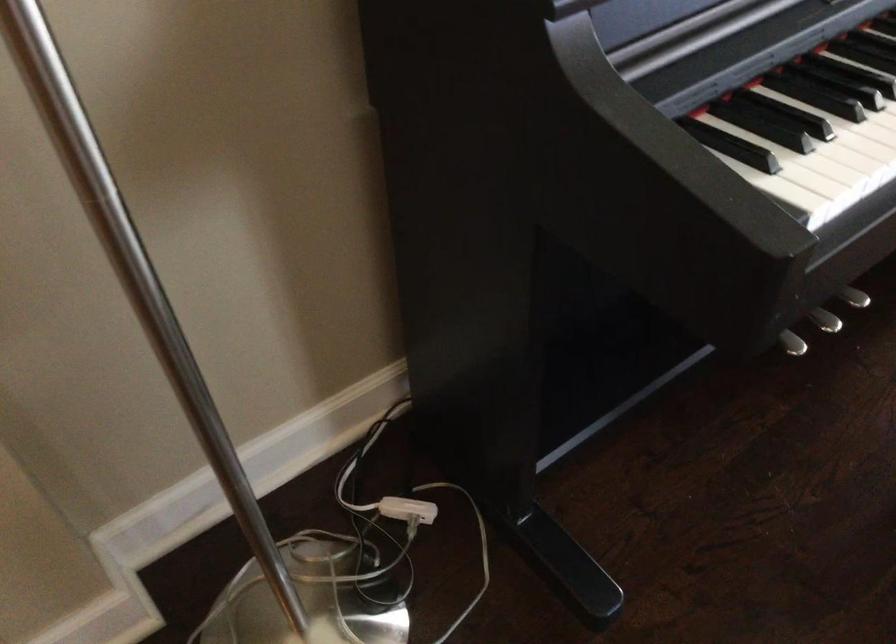
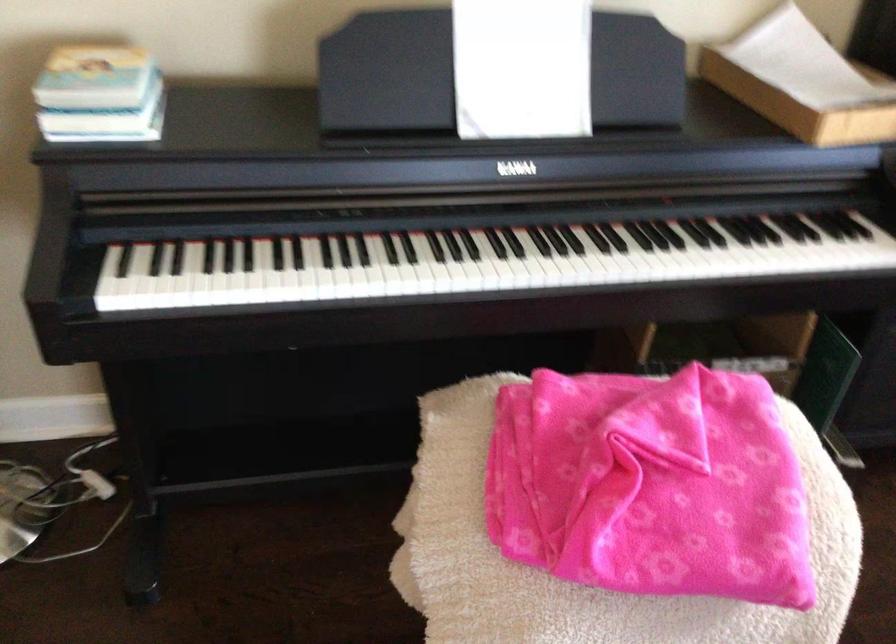
Question: In a continuous first-person perspective shot, in which direction is the camera moving?

Choices:
 (A) Left
 (B) Right
 (C) Forward
 (D) Backward

Answer: (B)